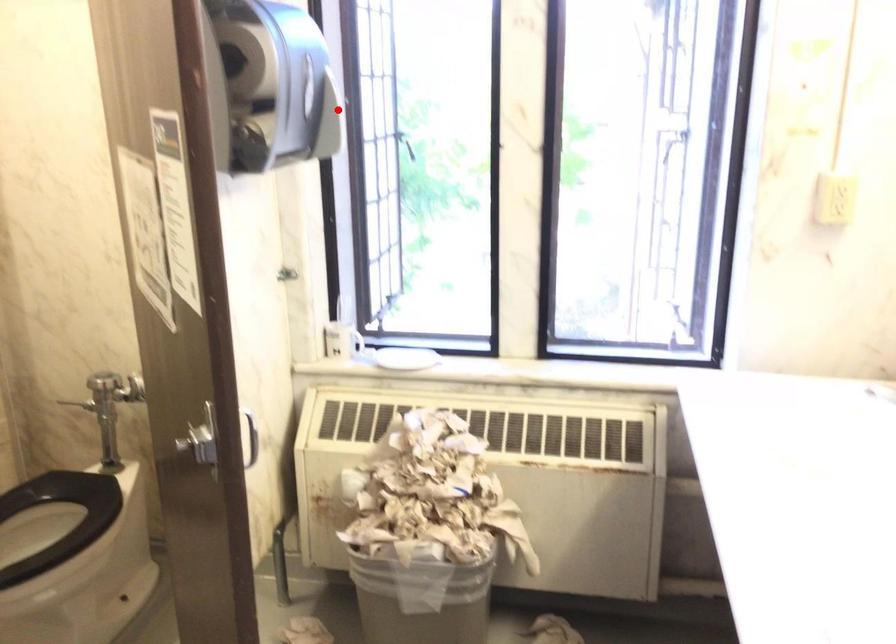
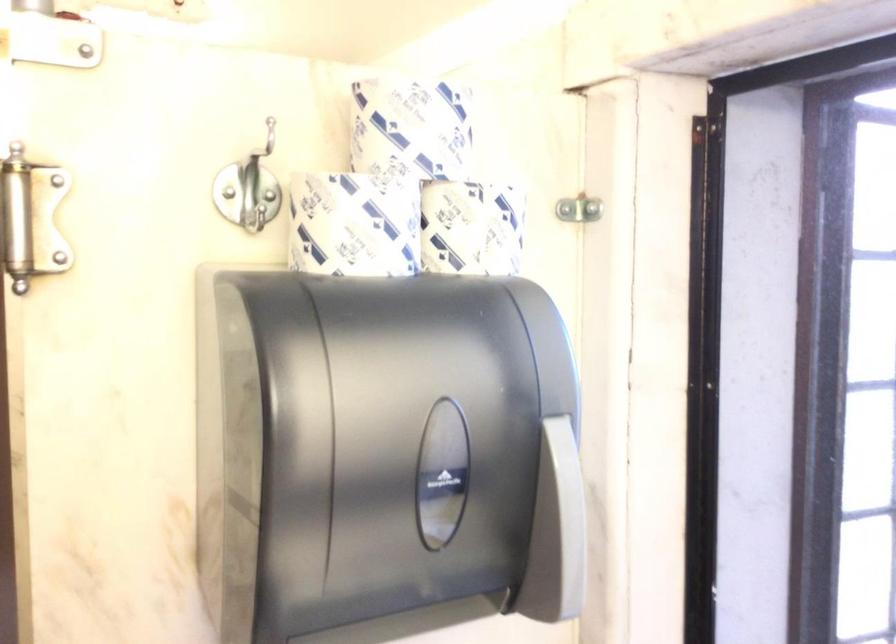
Question: I am providing you with two images of the same scene from different viewpoints. In image1, a red point is highlighted. Considering the same 3D point in image2, which of the following is correct?

Choices:
 (A) It is closer
 (B) It is farther

Answer: (A)